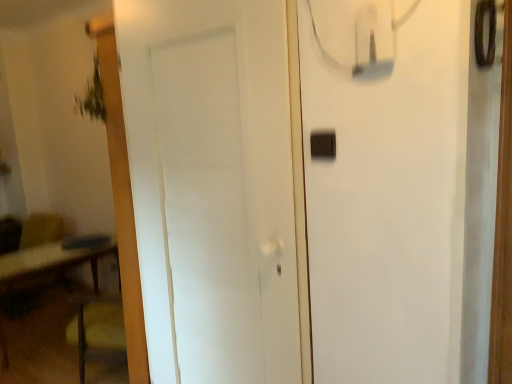
In order to face black plastic light switch at upper right, should I rotate leftwards or rightwards?

To face it directly, rotate right by 8.935 degrees.

Image resolution: width=512 pixels, height=384 pixels. Describe the element at coordinates (323, 144) in the screenshot. I see `black plastic light switch at upper right` at that location.

Where is `black plastic light switch at upper right`? This screenshot has height=384, width=512. black plastic light switch at upper right is located at coordinates (323, 144).

Measure the distance between point (332, 130) and camera.

The depth of point (332, 130) is 1.18 meters.

The width and height of the screenshot is (512, 384). Identify the location of white matte door at center. (212, 187).

The height and width of the screenshot is (384, 512). What do you see at coordinates (212, 187) in the screenshot? I see `white matte door at center` at bounding box center [212, 187].

What is the approximate height of white matte door at center?

5.65 feet.

This screenshot has width=512, height=384. What are the coordinates of `black plastic light switch at upper right` in the screenshot? It's located at (323, 144).

Can you confirm if black plastic light switch at upper right is positioned to the left of white matte door at center?

Incorrect, black plastic light switch at upper right is not on the left side of white matte door at center.

Does black plastic light switch at upper right lie in front of white matte door at center?

No.

Between point (324, 131) and point (170, 188), which one is positioned in front?

Point (324, 131)

From the image's perspective, is black plastic light switch at upper right positioned above or below white matte door at center?

Based on their image positions, black plastic light switch at upper right is located above white matte door at center.

In the scene shown: From a real-world perspective, is black plastic light switch at upper right on top of white matte door at center?

Correct, in the physical world, black plastic light switch at upper right is higher than white matte door at center.

From the picture: Which of these two, black plastic light switch at upper right or white matte door at center, is thinner?

With smaller width is black plastic light switch at upper right.

Between black plastic light switch at upper right and white matte door at center, which one has less height?

Standing shorter between the two is black plastic light switch at upper right.

Based on their sizes in the image, would you say black plastic light switch at upper right is bigger or smaller than white matte door at center?

In the image, black plastic light switch at upper right appears to be smaller than white matte door at center.

Would you say black plastic light switch at upper right is inside or outside white matte door at center?

black plastic light switch at upper right cannot be found inside white matte door at center.

Is black plastic light switch at upper right touching white matte door at center?

No.

Is black plastic light switch at upper right turned away from white matte door at center?

No, black plastic light switch at upper right is not facing away from white matte door at center.

From the picture: Can you tell me how much black plastic light switch at upper right and white matte door at center differ in facing direction?

The angular difference between black plastic light switch at upper right and white matte door at center is 4.01 degrees.

The width and height of the screenshot is (512, 384). What are the coordinates of `door below the black plastic light switch at upper right (from a real-world perspective)` in the screenshot? It's located at (212, 187).

Is white matte door at center to the left or to the right of black plastic light switch at upper right in the image?

From the image, it's evident that white matte door at center is to the left of black plastic light switch at upper right.

From the picture: Which object is further away from the camera, white matte door at center or black plastic light switch at upper right?

black plastic light switch at upper right is further away from the camera.

Which is in front, point (227, 381) or point (325, 133)?

Point (325, 133)

From the image's perspective, between white matte door at center and black plastic light switch at upper right, which one is located above?

From the image's view, black plastic light switch at upper right is above.

Based on the photo, from a real-world perspective, who is located lower, white matte door at center or black plastic light switch at upper right?

white matte door at center is physically lower.

Does white matte door at center have a lesser width compared to black plastic light switch at upper right?

Incorrect, the width of white matte door at center is not less than that of black plastic light switch at upper right.

From their relative heights in the image, would you say white matte door at center is taller or shorter than black plastic light switch at upper right?

white matte door at center is taller than black plastic light switch at upper right.

Looking at the image, does white matte door at center seem bigger or smaller compared to black plastic light switch at upper right?

Clearly, white matte door at center is larger in size than black plastic light switch at upper right.

Is white matte door at center completely or partially outside of black plastic light switch at upper right?

Yes, white matte door at center is outside of black plastic light switch at upper right.

Would you say white matte door at center is a long distance from black plastic light switch at upper right?

white matte door at center is actually quite close to black plastic light switch at upper right.

Is black plastic light switch at upper right at the back of white matte door at center?

No, white matte door at center is not facing the opposite direction of black plastic light switch at upper right.

How many degrees apart are the facing directions of white matte door at center and black plastic light switch at upper right?

They differ by 4.01 degrees in their facing directions.

Where is `light switch behind the white matte door at center`? This screenshot has height=384, width=512. light switch behind the white matte door at center is located at coordinates (323, 144).

Locate an element on the screen. Image resolution: width=512 pixels, height=384 pixels. light switch above the white matte door at center (from a real-world perspective) is located at coordinates (323, 144).

Where is `door that appears on the left of black plastic light switch at upper right`? The width and height of the screenshot is (512, 384). door that appears on the left of black plastic light switch at upper right is located at coordinates (212, 187).